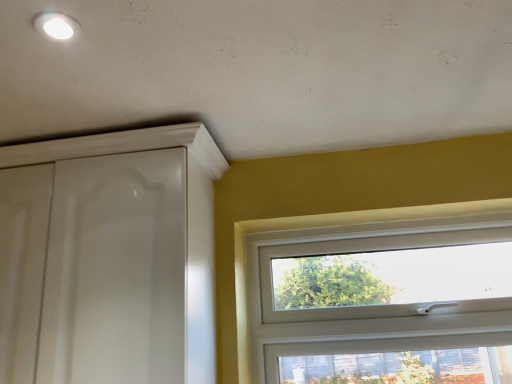
Describe the element at coordinates (335, 239) in the screenshot. I see `white plastic window at center` at that location.

This screenshot has height=384, width=512. I want to click on white plastic window at center, so click(335, 239).

Locate an element on the screen. Image resolution: width=512 pixels, height=384 pixels. white glossy cabinet at upper left is located at coordinates (x=115, y=270).

Describe the element at coordinates (115, 270) in the screenshot. I see `white glossy cabinet at upper left` at that location.

Locate an element on the screen. Image resolution: width=512 pixels, height=384 pixels. white plastic window at center is located at coordinates (335, 239).

Does white plastic window at center appear on the left side of white glossy cabinet at upper left?

In fact, white plastic window at center is to the right of white glossy cabinet at upper left.

Which object is more forward, white plastic window at center or white glossy cabinet at upper left?

white glossy cabinet at upper left is in front.

Which is behind, point (426, 217) or point (150, 379)?

The point (426, 217) is more distant.

Based on the photo, from the image's perspective, is white plastic window at center beneath white glossy cabinet at upper left?

Yes, from the image's perspective, white plastic window at center is beneath white glossy cabinet at upper left.

From a real-world perspective, is white plastic window at center over white glossy cabinet at upper left?

No.

Based on the photo, can you confirm if white plastic window at center is thinner than white glossy cabinet at upper left?

Indeed, white plastic window at center has a lesser width compared to white glossy cabinet at upper left.

Which of these two, white plastic window at center or white glossy cabinet at upper left, stands shorter?

white plastic window at center is shorter.

Between white plastic window at center and white glossy cabinet at upper left, which one has smaller size?

With smaller size is white plastic window at center.

Is white plastic window at center situated inside white glossy cabinet at upper left or outside?

white plastic window at center is spatially situated outside white glossy cabinet at upper left.

Are white plastic window at center and white glossy cabinet at upper left far apart?

Actually, white plastic window at center and white glossy cabinet at upper left are a little close together.

Is white glossy cabinet at upper left at the back of white plastic window at center?

No, white plastic window at center is not facing the opposite direction of white glossy cabinet at upper left.

What's the angular difference between white plastic window at center and white glossy cabinet at upper left's facing directions?

0.895 degrees.

Where is `window directly beneath the white glossy cabinet at upper left (from a real-world perspective)`? Image resolution: width=512 pixels, height=384 pixels. window directly beneath the white glossy cabinet at upper left (from a real-world perspective) is located at coordinates (335, 239).

Would you say white glossy cabinet at upper left is to the left or to the right of white plastic window at center in the picture?

Based on their positions, white glossy cabinet at upper left is located to the left of white plastic window at center.

Relative to white plastic window at center, is white glossy cabinet at upper left in front or behind?

white glossy cabinet at upper left is positioned closer to the viewer than white plastic window at center.

Which is closer, (x=137, y=165) or (x=266, y=340)?

Answer: Positioned in front is point (x=137, y=165).

From the image's perspective, is white glossy cabinet at upper left under white plastic window at center?

No.

From a real-world perspective, relative to white plastic window at center, is white glossy cabinet at upper left vertically above or below?

white glossy cabinet at upper left is situated higher than white plastic window at center in the real world.

Can you confirm if white glossy cabinet at upper left is wider than white plastic window at center?

Yes, white glossy cabinet at upper left is wider than white plastic window at center.

In the scene shown: Between white glossy cabinet at upper left and white plastic window at center, which one has more height?

white glossy cabinet at upper left is taller.

In terms of size, does white glossy cabinet at upper left appear bigger or smaller than white plastic window at center?

Clearly, white glossy cabinet at upper left is larger in size than white plastic window at center.

Is white glossy cabinet at upper left inside or outside of white plastic window at center?

The correct answer is: outside.

Is white glossy cabinet at upper left directly adjacent to white plastic window at center?

They are not placed beside each other.

Is white glossy cabinet at upper left oriented away from white plastic window at center?

No, white glossy cabinet at upper left is not facing away from white plastic window at center.

How many degrees apart are the facing directions of white glossy cabinet at upper left and white plastic window at center?

The angular difference between white glossy cabinet at upper left and white plastic window at center is 0.895 degrees.

You are a GUI agent. You are given a task and a screenshot of the screen. Output one action in this format:
    pyautogui.click(x=<x>, y=<y>)
    Task: Click on the window behind the white glossy cabinet at upper left
    The width and height of the screenshot is (512, 384).
    Given the screenshot: What is the action you would take?
    pos(335,239)

This screenshot has height=384, width=512. I want to click on screen door on the left of the white plastic window at center, so click(x=115, y=270).

The height and width of the screenshot is (384, 512). What are the coordinates of `screen door located in front of the white plastic window at center` in the screenshot? It's located at (115, 270).